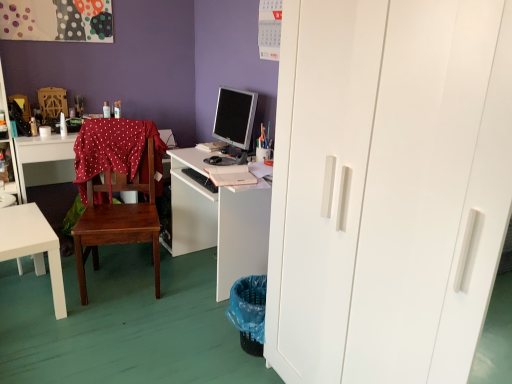
The width and height of the screenshot is (512, 384). I want to click on vacant space positioned to the left of white glossy coffee cup at upper left, so click(26, 135).